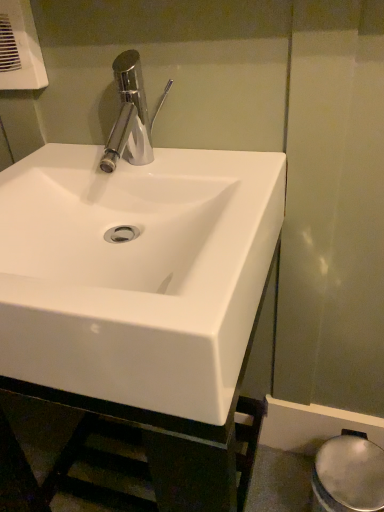
Question: Is white plastic hand dryer at upper left turned away from white glossy sink at center?

Choices:
 (A) yes
 (B) no

Answer: (B)

Question: From the image's perspective, would you say white plastic hand dryer at upper left is positioned over white glossy sink at center?

Choices:
 (A) no
 (B) yes

Answer: (B)

Question: Is white plastic hand dryer at upper left positioned beyond the bounds of white glossy sink at center?

Choices:
 (A) no
 (B) yes

Answer: (B)

Question: From the image's perspective, is white plastic hand dryer at upper left under white glossy sink at center?

Choices:
 (A) no
 (B) yes

Answer: (A)

Question: Is the depth of white plastic hand dryer at upper left greater than that of white glossy sink at center?

Choices:
 (A) no
 (B) yes

Answer: (B)

Question: In the image, is white glossy bidet at lower right positioned in front of or behind white glossy sink at center?

Choices:
 (A) front
 (B) behind

Answer: (B)

Question: From a real-world perspective, is white glossy bidet at lower right physically located above or below white glossy sink at center?

Choices:
 (A) below
 (B) above

Answer: (A)

Question: In terms of height, does white glossy bidet at lower right look taller or shorter compared to white glossy sink at center?

Choices:
 (A) short
 (B) tall

Answer: (A)

Question: Is white glossy bidet at lower right bigger or smaller than white glossy sink at center?

Choices:
 (A) small
 (B) big

Answer: (A)

Question: Is white plastic hand dryer at upper left situated inside white glossy bidet at lower right or outside?

Choices:
 (A) outside
 (B) inside

Answer: (A)

Question: From a real-world perspective, relative to white glossy bidet at lower right, is white plastic hand dryer at upper left vertically above or below?

Choices:
 (A) below
 (B) above

Answer: (B)

Question: Considering the positions of white plastic hand dryer at upper left and white glossy bidet at lower right in the image, is white plastic hand dryer at upper left bigger or smaller than white glossy bidet at lower right?

Choices:
 (A) small
 (B) big

Answer: (A)

Question: In terms of height, does white plastic hand dryer at upper left look taller or shorter compared to white glossy bidet at lower right?

Choices:
 (A) short
 (B) tall

Answer: (A)

Question: In terms of width, does white plastic hand dryer at upper left look wider or thinner when compared to white glossy sink at center?

Choices:
 (A) wide
 (B) thin

Answer: (B)

Question: From a real-world perspective, is white plastic hand dryer at upper left physically located above or below white glossy sink at center?

Choices:
 (A) above
 (B) below

Answer: (A)